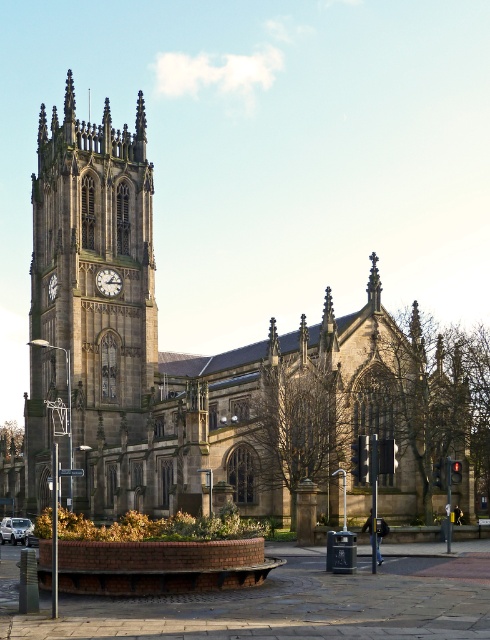
Based on the photo, between brown stone church at center and stone clock tower at center, which one has more height?

stone clock tower at center is taller.

Measure the distance between point (141, 205) and camera.

They are 385.47 feet apart.

The image size is (490, 640). I want to click on brown stone church at center, so click(x=213, y=365).

Consider the image. Measure the distance from stone clock tower at center to matte brown clock at center-left.

stone clock tower at center is 8.70 meters away from matte brown clock at center-left.

Between point (39, 454) and point (101, 285), which one is positioned behind?

Positioned behind is point (101, 285).

Does point (77, 193) lie in front of point (115, 296)?

No.

At what (x,y) coordinates should I click in order to perform the action: click on stone clock tower at center. Please return your answer as a coordinate pair (x, y). Looking at the image, I should click on (91, 301).

Does brown stone church at center appear over matte brown clock at center-left?

Actually, brown stone church at center is below matte brown clock at center-left.

Does point (373, 381) come in front of point (116, 291)?

Yes, it is.

Where is `brown stone church at center`? brown stone church at center is located at coordinates (213, 365).